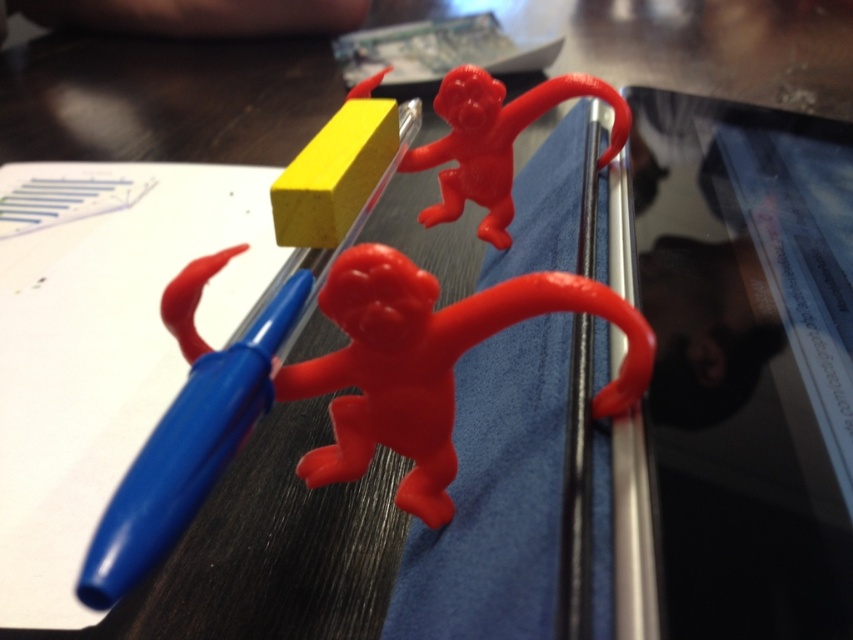
Question: Is matte plastic monkey at center to the right of matte plastic monkey at upper center from the viewer's perspective?

Choices:
 (A) yes
 (B) no

Answer: (B)

Question: Which object is the closest to the matte plastic monkey at center?

Choices:
 (A) matte plastic monkey at upper center
 (B) blue plastic pencil at left

Answer: (B)

Question: Among these objects, which one is nearest to the camera?

Choices:
 (A) matte plastic monkey at center
 (B) matte plastic monkey at upper center

Answer: (A)

Question: Can you confirm if blue plastic pencil at left is thinner than matte plastic monkey at center?

Choices:
 (A) no
 (B) yes

Answer: (B)

Question: Is matte plastic monkey at center above matte plastic monkey at upper center?

Choices:
 (A) no
 (B) yes

Answer: (A)

Question: Which object is closer to the camera taking this photo?

Choices:
 (A) matte plastic monkey at center
 (B) blue plastic pencil at left
 (C) matte plastic monkey at upper center

Answer: (B)